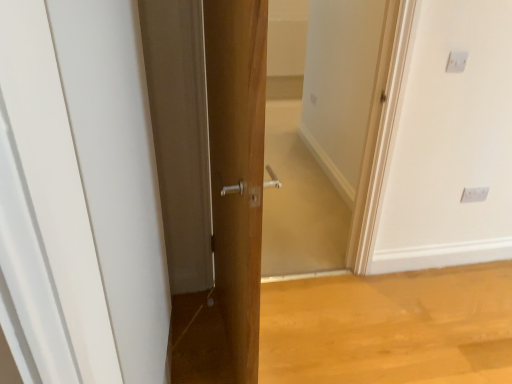
Measure the distance between point (459, 60) and camera.

Point (459, 60) and camera are 5.98 feet apart from each other.

Measure the distance between white glossy door at center and camera.

white glossy door at center and camera are 11.58 inches apart from each other.

What are the coordinates of `white plastic electric outlet at upper right, placed as the second electric outlet when sorted from right to left` in the screenshot? It's located at (456, 62).

Does white plastic electric outlet at upper right, marked as the 2th electric outlet in a top-to-bottom arrangement, turn towards white plastic electric outlet at upper right, marked as the second electric outlet in a bottom-to-top arrangement?

No, white plastic electric outlet at upper right, marked as the 2th electric outlet in a top-to-bottom arrangement, does not turn towards white plastic electric outlet at upper right, marked as the second electric outlet in a bottom-to-top arrangement.

Is white plastic electric outlet at upper right, which is the 2th electric outlet in left-to-right order, further to the viewer compared to white plastic electric outlet at upper right, marked as the second electric outlet in a bottom-to-top arrangement?

Yes, it is.

Is white plastic electric outlet at upper right, marked as the second electric outlet in a front-to-back arrangement, not within white plastic electric outlet at upper right, marked as the first electric outlet in a left-to-right arrangement?

white plastic electric outlet at upper right, marked as the second electric outlet in a front-to-back arrangement, is positioned outside white plastic electric outlet at upper right, marked as the first electric outlet in a left-to-right arrangement.

From a real-world perspective, is white plastic electric outlet at upper right, which is the 2th electric outlet in left-to-right order, beneath white plastic electric outlet at upper right, which ranks as the first electric outlet in front-to-back order?

Yes, from a real-world perspective, white plastic electric outlet at upper right, which is the 2th electric outlet in left-to-right order, is beneath white plastic electric outlet at upper right, which ranks as the first electric outlet in front-to-back order.

Does white glossy door at center turn towards white plastic electric outlet at upper right, marked as the second electric outlet in a front-to-back arrangement?

Yes, white glossy door at center is facing white plastic electric outlet at upper right, marked as the second electric outlet in a front-to-back arrangement.

Is white glossy door at center positioned beyond the bounds of white plastic electric outlet at upper right, which is the 2th electric outlet in left-to-right order?

Yes, white glossy door at center is outside of white plastic electric outlet at upper right, which is the 2th electric outlet in left-to-right order.

Does point (42, 377) lie in front of point (480, 188)?

That is True.

Is point (457, 71) positioned behind point (483, 188)?

No, (457, 71) is in front of (483, 188).

Considering the relative sizes of white plastic electric outlet at upper right, which appears as the 1th electric outlet when viewed from the top, and white plastic electric outlet at upper right, marked as the second electric outlet in a front-to-back arrangement, in the image provided, is white plastic electric outlet at upper right, which appears as the 1th electric outlet when viewed from the top, bigger than white plastic electric outlet at upper right, marked as the second electric outlet in a front-to-back arrangement,?

No.

How many degrees apart are the facing directions of white plastic electric outlet at upper right, which appears as the 1th electric outlet when viewed from the top, and white plastic electric outlet at upper right, marked as the 2th electric outlet in a top-to-bottom arrangement?

white plastic electric outlet at upper right, which appears as the 1th electric outlet when viewed from the top, and white plastic electric outlet at upper right, marked as the 2th electric outlet in a top-to-bottom arrangement, are facing 0.0219 degrees away from each other.

Is white glossy door at center in front of or behind white plastic electric outlet at upper right, marked as the first electric outlet in a left-to-right arrangement, in the image?

In the image, white glossy door at center appears in front of white plastic electric outlet at upper right, marked as the first electric outlet in a left-to-right arrangement.

Is white glossy door at center inside or outside of white plastic electric outlet at upper right, marked as the second electric outlet in a bottom-to-top arrangement?

white glossy door at center is not inside white plastic electric outlet at upper right, marked as the second electric outlet in a bottom-to-top arrangement, it's outside.

Which of these two, white glossy door at center or white plastic electric outlet at upper right, marked as the second electric outlet in a bottom-to-top arrangement, is thinner?

white plastic electric outlet at upper right, marked as the second electric outlet in a bottom-to-top arrangement, is thinner.

Based on the photo, from the image's perspective, between white glossy door at center and white plastic electric outlet at upper right, which ranks as the first electric outlet in front-to-back order, who is located below?

white glossy door at center, from the image's perspective.

Is white plastic electric outlet at upper right, which ranks as the 1th electric outlet in back-to-front order, outside of white glossy door at center?

Yes, white plastic electric outlet at upper right, which ranks as the 1th electric outlet in back-to-front order, is not within white glossy door at center.

Is white plastic electric outlet at upper right, which is counted as the first electric outlet, starting from the right, to the right of white glossy door at center from the viewer's perspective?

Correct, you'll find white plastic electric outlet at upper right, which is counted as the first electric outlet, starting from the right, to the right of white glossy door at center.

In the image, is white plastic electric outlet at upper right, which ranks as the 1th electric outlet in back-to-front order, positioned in front of or behind white glossy door at center?

Visually, white plastic electric outlet at upper right, which ranks as the 1th electric outlet in back-to-front order, is located behind white glossy door at center.

From a real-world perspective, does white plastic electric outlet at upper right, marked as the first electric outlet in a left-to-right arrangement, sit lower than white glossy door at center?

No.

Which of these two, white plastic electric outlet at upper right, marked as the first electric outlet in a left-to-right arrangement, or white glossy door at center, stands shorter?

white plastic electric outlet at upper right, marked as the first electric outlet in a left-to-right arrangement.

Can you tell me how much white plastic electric outlet at upper right, which ranks as the first electric outlet in front-to-back order, and white glossy door at center differ in facing direction?

They differ by 88 degrees in their facing directions.

Locate an element on the screen. The image size is (512, 384). the 1st electric outlet counting from the right of the white glossy door at center is located at coordinates (456, 62).

At what (x,y) coordinates should I click in order to perform the action: click on electric outlet above the white plastic electric outlet at upper right, marked as the 2th electric outlet in a top-to-bottom arrangement (from a real-world perspective). Please return your answer as a coordinate pair (x, y). Image resolution: width=512 pixels, height=384 pixels. Looking at the image, I should click on (456, 62).

I want to click on door in front of the white plastic electric outlet at upper right, placed as the first electric outlet when sorted from bottom to top, so click(80, 195).

When comparing their distances from white plastic electric outlet at upper right, which appears as the 1th electric outlet when viewed from the top, does white glossy door at center or white plastic electric outlet at upper right, which ranks as the 1th electric outlet in back-to-front order, seem closer?

Among the two, white plastic electric outlet at upper right, which ranks as the 1th electric outlet in back-to-front order, is located nearer to white plastic electric outlet at upper right, which appears as the 1th electric outlet when viewed from the top.

Which object lies further to the anchor point white plastic electric outlet at upper right, which is the 2th electric outlet in left-to-right order, white plastic electric outlet at upper right, which ranks as the first electric outlet in front-to-back order, or white glossy door at center?

Based on the image, white glossy door at center appears to be further to white plastic electric outlet at upper right, which is the 2th electric outlet in left-to-right order.

When comparing their distances from white plastic electric outlet at upper right, which is the 2th electric outlet in left-to-right order, does white glossy door at center or white plastic electric outlet at upper right, which ranks as the first electric outlet in front-to-back order, seem closer?

white plastic electric outlet at upper right, which ranks as the first electric outlet in front-to-back order, is positioned closer to the anchor white plastic electric outlet at upper right, which is the 2th electric outlet in left-to-right order.

Looking at the image, which one is located further to white glossy door at center, white plastic electric outlet at upper right, which appears as the 1th electric outlet when viewed from the top, or white plastic electric outlet at upper right, marked as the 2th electric outlet in a top-to-bottom arrangement?

Among the two, white plastic electric outlet at upper right, marked as the 2th electric outlet in a top-to-bottom arrangement, is located further to white glossy door at center.

Considering their positions, is white plastic electric outlet at upper right, which is counted as the first electric outlet, starting from the right, positioned closer to white glossy door at center than white plastic electric outlet at upper right, which ranks as the first electric outlet in front-to-back order?

The object closer to white glossy door at center is white plastic electric outlet at upper right, which ranks as the first electric outlet in front-to-back order.

Which object lies further to the anchor point white plastic electric outlet at upper right, the 2th electric outlet when ordered from back to front, white plastic electric outlet at upper right, which is counted as the first electric outlet, starting from the right, or white glossy door at center?

The object further to white plastic electric outlet at upper right, the 2th electric outlet when ordered from back to front, is white glossy door at center.

What are the coordinates of `electric outlet between white glossy door at center and white plastic electric outlet at upper right, marked as the second electric outlet in a front-to-back arrangement, from front to back` in the screenshot? It's located at (456, 62).